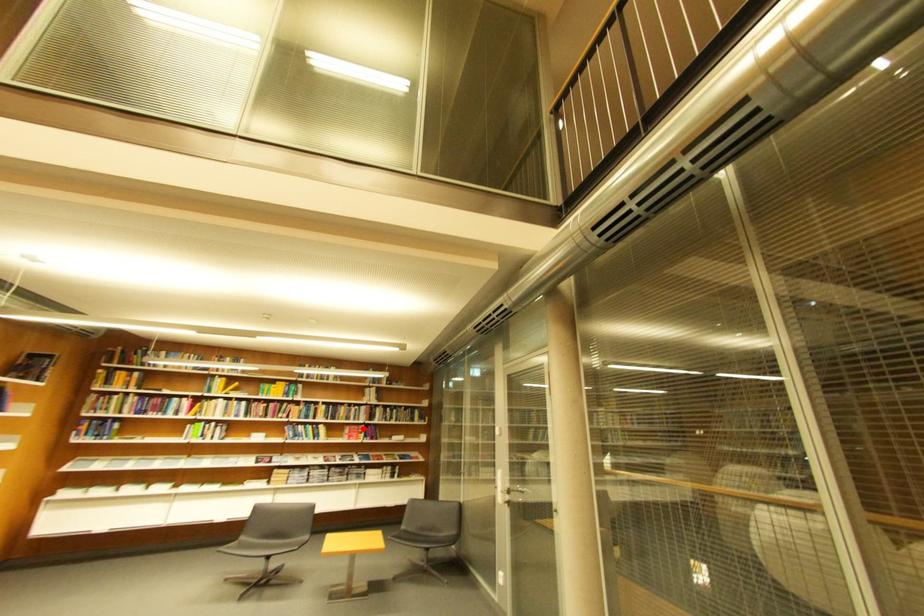
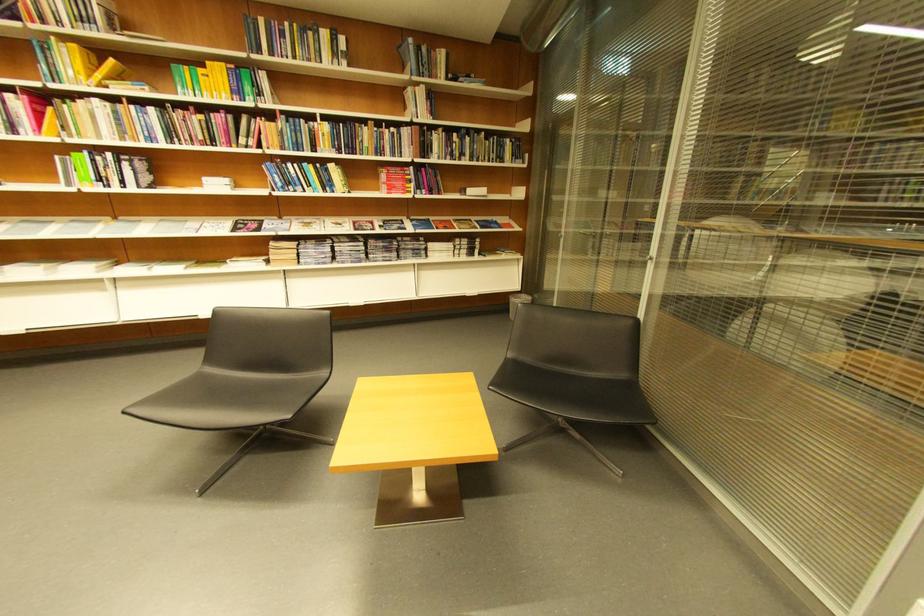
Locate, in the second image, the point that corresponds to the highlighted location in the first image.

(403, 172)